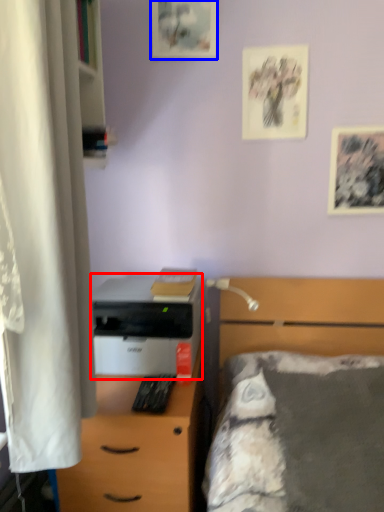
Question: Which object appears farthest to the camera in this image, printer (highlighted by a red box) or picture frame (highlighted by a blue box)?

Choices:
 (A) printer
 (B) picture frame

Answer: (B)